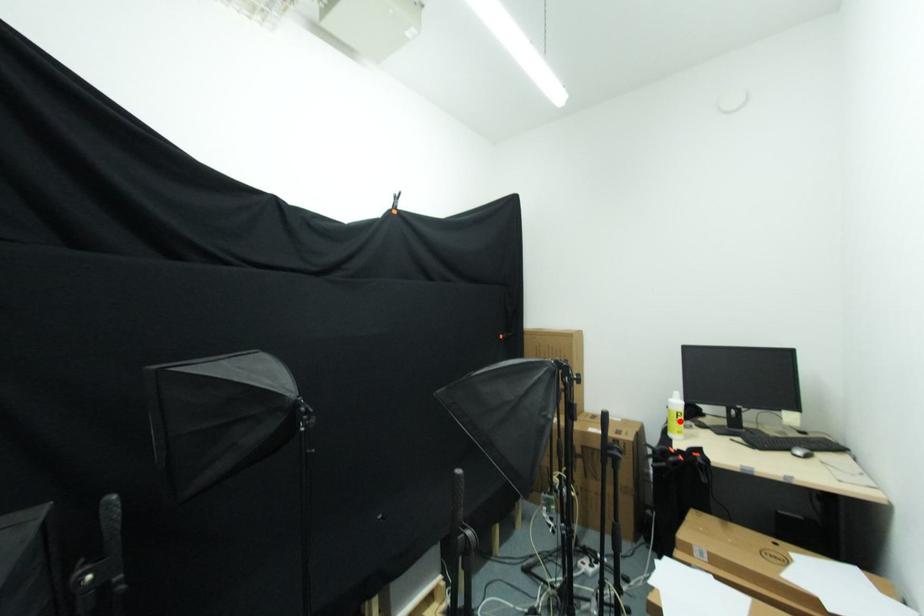
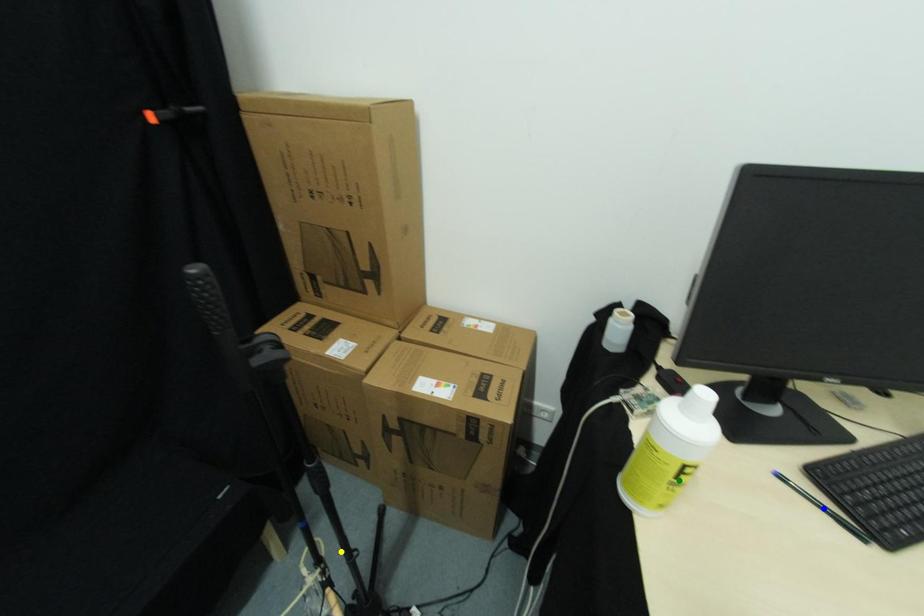
Question: I am providing you with two images of the same scene from different viewpoints. A red point is marked on the first image. You are given multiple points on the second image. Which point in image 2 represents the same 3d spot as the red point in image 1?

Choices:
 (A) green point
 (B) yellow point
 (C) blue point

Answer: (A)